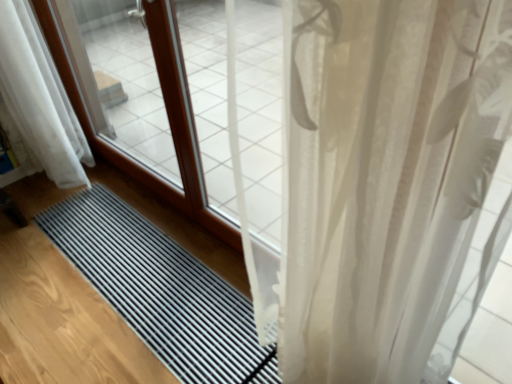
Question: From a real-world perspective, is black rubber mat at center above or below translucent white curtain at right, which is the first curtain in front-to-back order?

Choices:
 (A) above
 (B) below

Answer: (B)

Question: Considering the positions of black rubber mat at center and translucent white curtain at right, arranged as the first curtain when viewed from the right, in the image, is black rubber mat at center taller or shorter than translucent white curtain at right, arranged as the first curtain when viewed from the right,?

Choices:
 (A) short
 (B) tall

Answer: (A)

Question: Which is nearer to the black rubber mat at center?

Choices:
 (A) white sheer curtain at lower left, which is counted as the 1th curtain, starting from the left
 (B) translucent white curtain at right, marked as the second curtain in a back-to-front arrangement

Answer: (A)

Question: Estimate the real-world distances between objects in this image. Which object is farther from the translucent white curtain at right, arranged as the first curtain when viewed from the right?

Choices:
 (A) white sheer curtain at lower left, which appears as the first curtain when viewed from the back
 (B) black rubber mat at center

Answer: (A)